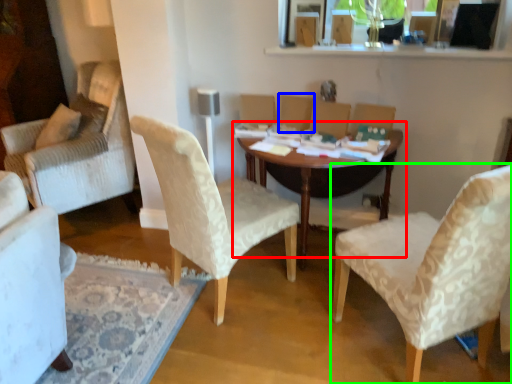
Question: Which object is the closest to the table (highlighted by a red box)? Choose among these: armchair (highlighted by a blue box) or chair (highlighted by a green box).

Choices:
 (A) armchair
 (B) chair

Answer: (A)